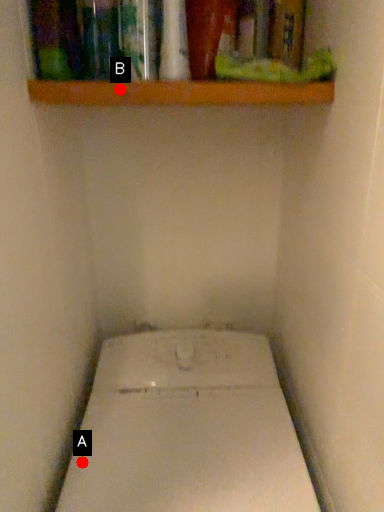
Question: Two points are circled on the image, labeled by A and B beside each circle. Among these points, which one is farthest from the camera?

Choices:
 (A) A is further
 (B) B is further

Answer: (A)